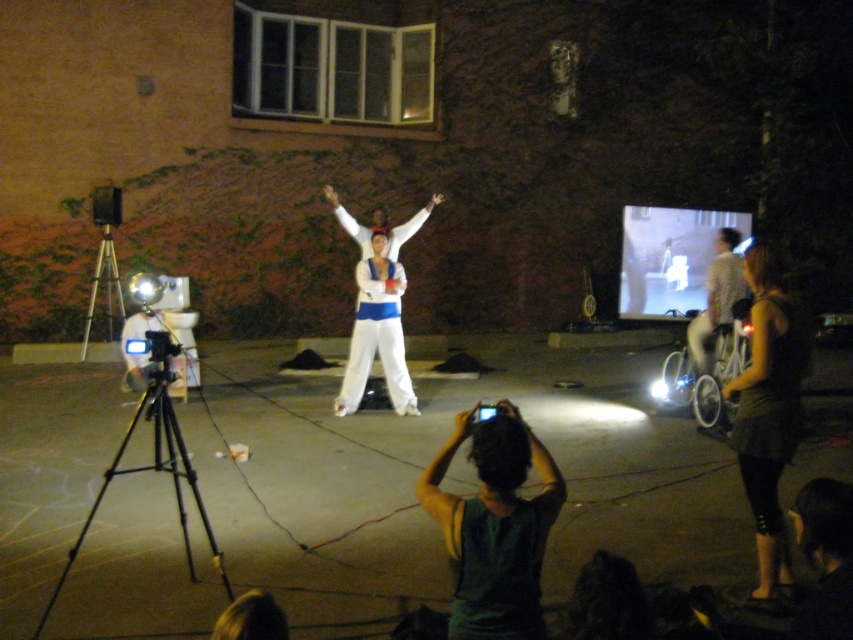
Question: Does dark green tank top at center lie behind black matte tripod at lower left?

Choices:
 (A) no
 (B) yes

Answer: (A)

Question: Among these points, which one is farthest from the camera?

Choices:
 (A) (714, 241)
 (B) (88, 307)

Answer: (A)

Question: Does white matte pants at center have a smaller size compared to white fabric bicycle at right?

Choices:
 (A) no
 (B) yes

Answer: (A)

Question: Does dark green tank top at center have a greater width compared to black matte tripod at lower left?

Choices:
 (A) no
 (B) yes

Answer: (A)

Question: Based on their relative distances, which object is farther from the silver metallic tripod at left?

Choices:
 (A) white fabric bicycle at right
 (B) black matte tripod at lower left

Answer: (A)

Question: Among these points, which one is farthest from the camera?

Choices:
 (A) (730, 316)
 (B) (357, 282)

Answer: (B)